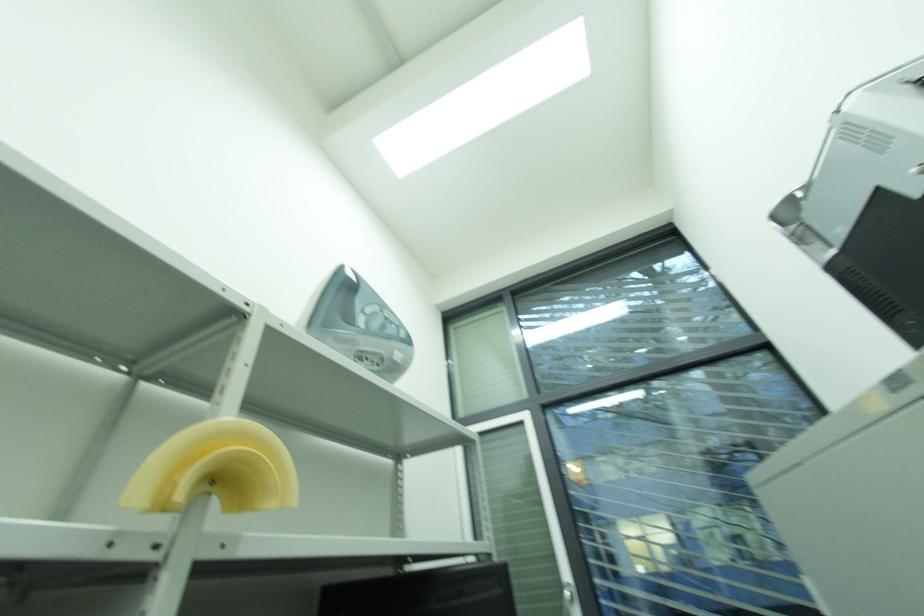
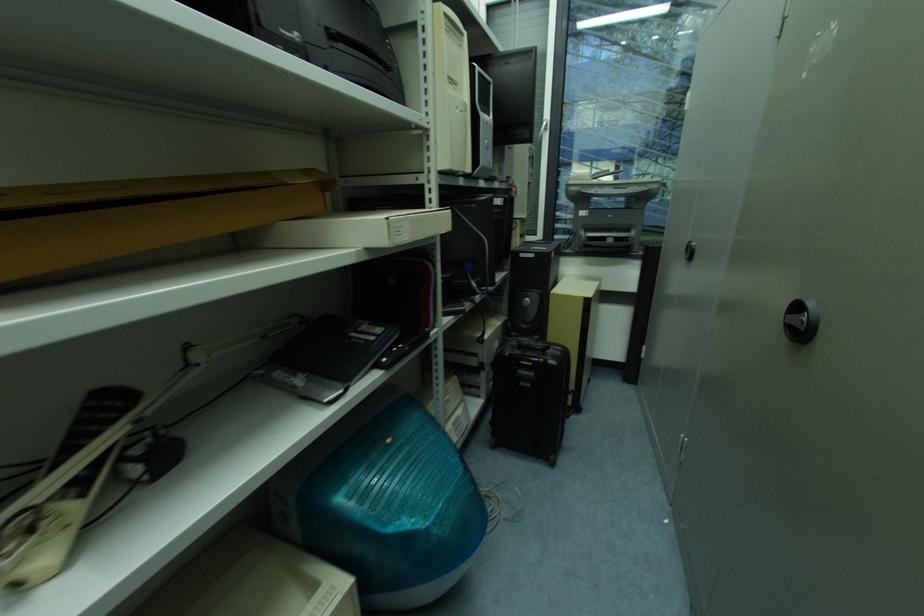
Question: The images are taken continuously from a first-person perspective. In which direction is your viewpoint rotating?

Choices:
 (A) Left
 (B) Right
 (C) Up
 (D) Down

Answer: (D)